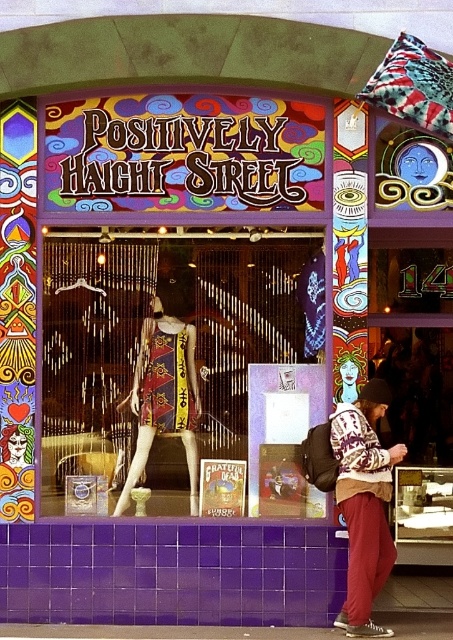
Is knit sweater at center thinner than printed fabric dress at center?

Yes, knit sweater at center is thinner than printed fabric dress at center.

Measure the distance between knit sweater at center and printed fabric dress at center.

knit sweater at center is 1.19 meters away from printed fabric dress at center.

In order to click on knit sweater at center in this screenshot , I will do `click(364, 502)`.

Does textured fabric dress at center appear on the left side of knit sweater at center?

Indeed, textured fabric dress at center is positioned on the left side of knit sweater at center.

Where is `textured fabric dress at center`? This screenshot has height=640, width=453. textured fabric dress at center is located at coordinates (174, 365).

Identify the location of textured fabric dress at center. This screenshot has width=453, height=640. (174, 365).

Which is below, textured fabric dress at center or printed fabric dress at center?

printed fabric dress at center is lower down.

Measure the distance between textured fabric dress at center and printed fabric dress at center.

They are 10.01 inches apart.

Does point (322, 234) come in front of point (174, 410)?

Yes, it is in front of point (174, 410).

Locate an element on the screen. The height and width of the screenshot is (640, 453). textured fabric dress at center is located at coordinates (174, 365).